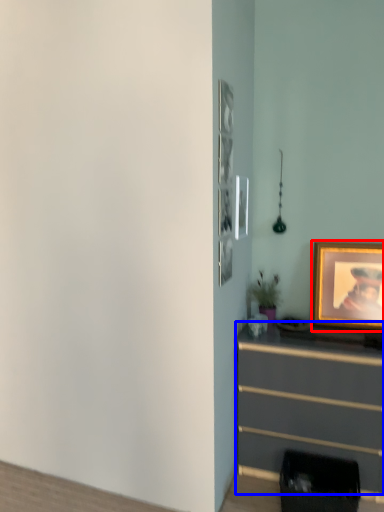
Question: Which object is further to the camera taking this photo, picture frame (highlighted by a red box) or chest of drawers (highlighted by a blue box)?

Choices:
 (A) picture frame
 (B) chest of drawers

Answer: (A)